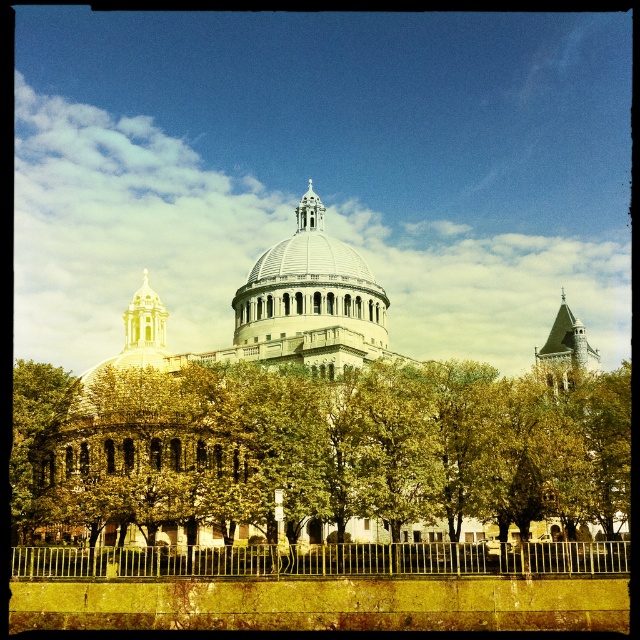
You are standing at the entrance of the cathedral and notice the gold metallic fence at lower center and the white marble dome at center. Which object is shorter in height?

The gold metallic fence at lower center is shorter in height compared to the white marble dome at center.

You are standing in front of the grand architectural structure and want to take a photo of the gold metallic fence at lower center without the green leafy tree at center blocking it. How should you adjust your position?

The gold metallic fence at lower center is behind the green leafy tree at center, so to avoid the tree blocking the fence, you should move to a position where the fence is no longer obscured by the tree, perhaps by moving to the side or further back.